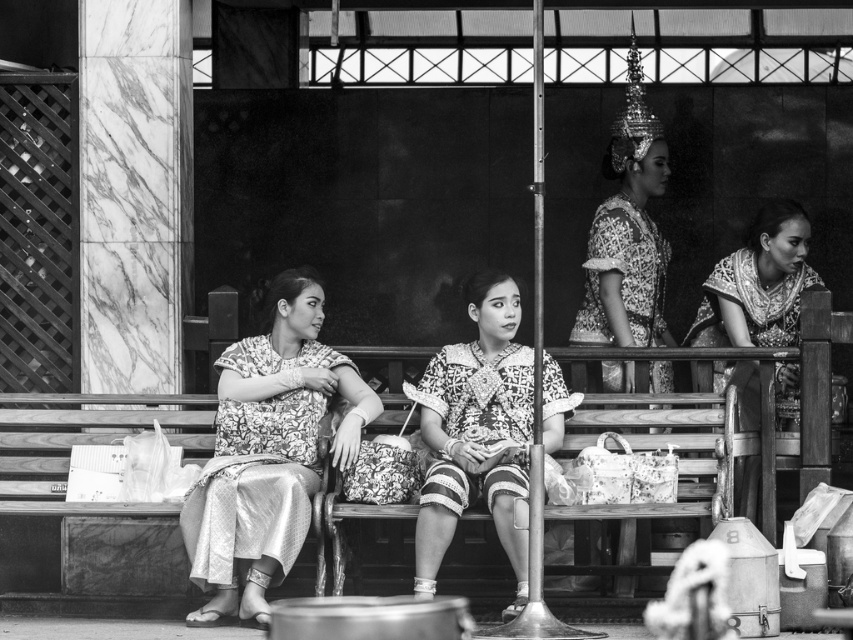
Between point (283, 365) and point (787, 342), which one is positioned in front?

Point (283, 365) is in front.

Is printed silk dress at center positioned at the back of silky fabric dress at center?

No, it is in front of silky fabric dress at center.

Is point (247, 515) positioned in front of point (772, 230)?

That is True.

You are a GUI agent. You are given a task and a screenshot of the screen. Output one action in this format:
    pyautogui.click(x=<x>, y=<y>)
    Task: Click on the printed silk dress at center
    The height and width of the screenshot is (640, 853).
    Given the screenshot: What is the action you would take?
    pyautogui.click(x=268, y=451)

Is wooden bench at center bigger than silky fabric dress at center?

Correct, wooden bench at center is larger in size than silky fabric dress at center.

Can you confirm if wooden bench at center is shorter than silky fabric dress at center?

No.

Describe the element at coordinates (83, 442) in the screenshot. I see `wooden bench at center` at that location.

You are a GUI agent. You are given a task and a screenshot of the screen. Output one action in this format:
    pyautogui.click(x=<x>, y=<y>)
    Task: Click on the wooden bench at center
    The image size is (853, 640).
    Given the screenshot: What is the action you would take?
    pyautogui.click(x=83, y=442)

Is point (727, 397) closer to camera compared to point (492, 387)?

That is True.

The width and height of the screenshot is (853, 640). What do you see at coordinates (83, 442) in the screenshot? I see `wooden bench at center` at bounding box center [83, 442].

Image resolution: width=853 pixels, height=640 pixels. I want to click on wooden bench at center, so click(x=83, y=442).